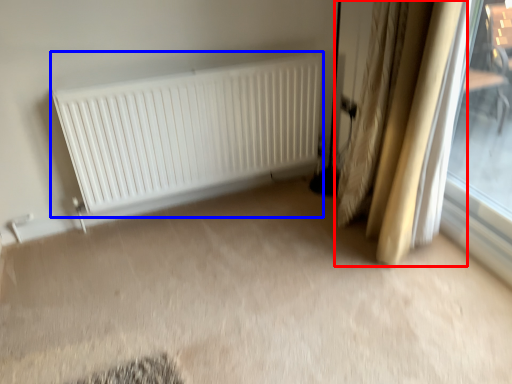
Question: Which of the following is the closest to the observer, curtain (highlighted by a red box) or radiator (highlighted by a blue box)?

Choices:
 (A) curtain
 (B) radiator

Answer: (A)